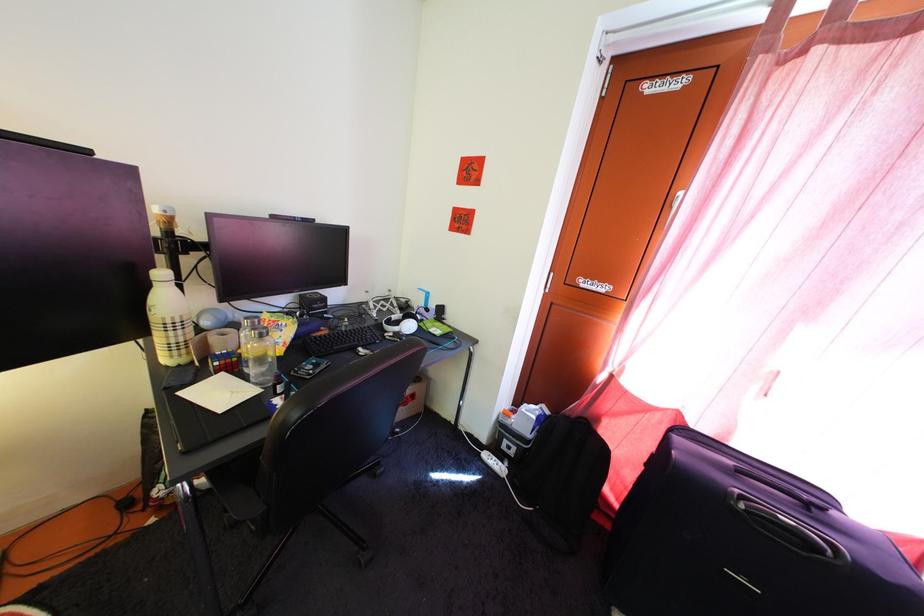
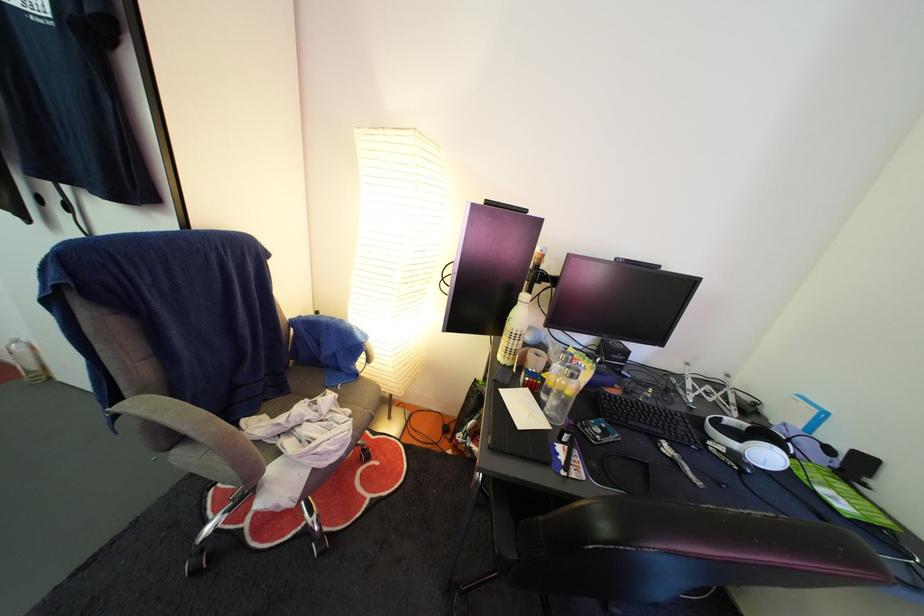
Question: The camera is either moving clockwise (left) or counter-clockwise (right) around the object. The first image is from the beginning of the video and the second image is from the end. Is the camera moving left or right when shooting the video?

Choices:
 (A) Left
 (B) Right

Answer: (B)